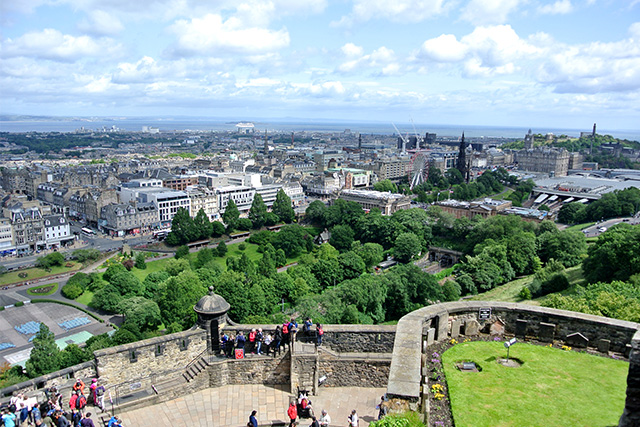
Where is `stairs`? The image size is (640, 427). stairs is located at coordinates (189, 372), (106, 413).